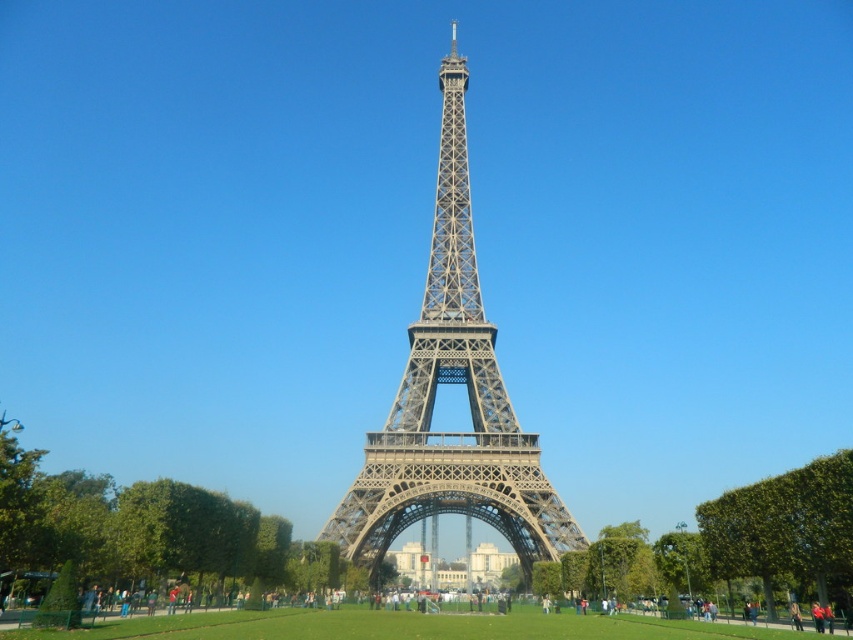
Is point (465, 372) farther from camera compared to point (827, 461)?

Yes.

Is metallic gray eiffel tower at center shorter than green leafy tree at center?

In fact, metallic gray eiffel tower at center may be taller than green leafy tree at center.

Is point (465, 166) positioned after point (738, 563)?

Yes, point (465, 166) is behind point (738, 563).

This screenshot has width=853, height=640. What are the coordinates of `metallic gray eiffel tower at center` in the screenshot? It's located at (467, 397).

Which is more to the right, metallic gray eiffel tower at center or green leafy tree at lower left?

Positioned to the right is metallic gray eiffel tower at center.

Does metallic gray eiffel tower at center have a greater height compared to green leafy tree at lower left?

Yes, metallic gray eiffel tower at center is taller than green leafy tree at lower left.

Which is behind, point (393, 403) or point (47, 500)?

Point (393, 403)

I want to click on metallic gray eiffel tower at center, so click(467, 397).

Does green leafy tree at lower left have a lesser height compared to green leafy tree at center?

No, green leafy tree at lower left is not shorter than green leafy tree at center.

Where is `green leafy tree at lower left`? green leafy tree at lower left is located at coordinates (148, 529).

Who is more forward, (42, 493) or (537, 589)?

Point (42, 493) is more forward.

At what (x,y) coordinates should I click in order to perform the action: click on green leafy tree at lower left. Please return your answer as a coordinate pair (x, y). This screenshot has height=640, width=853. Looking at the image, I should click on (148, 529).